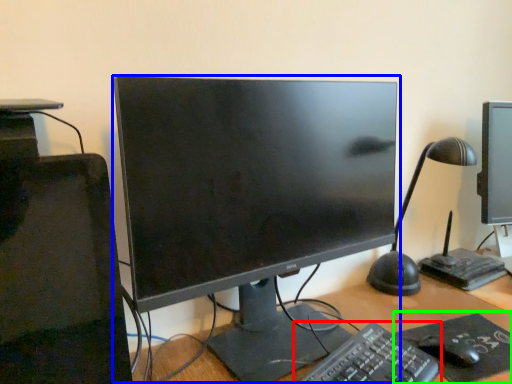
Question: Which is farther away from computer keyboard (highlighted by a red box)? computer monitor (highlighted by a blue box) or mousepad (highlighted by a green box)?

Choices:
 (A) computer monitor
 (B) mousepad

Answer: (A)